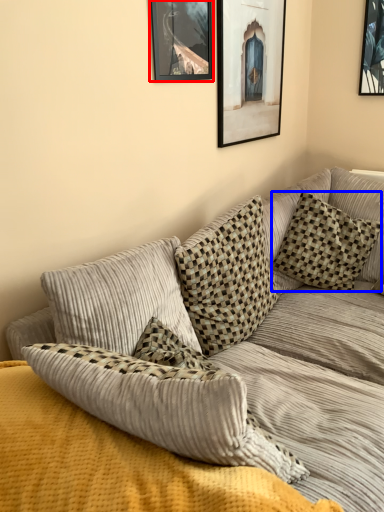
Question: Among these objects, which one is farthest to the camera, picture frame (highlighted by a red box) or pillow (highlighted by a blue box)?

Choices:
 (A) picture frame
 (B) pillow

Answer: (B)